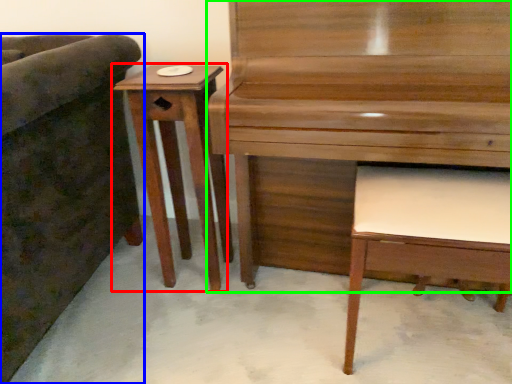
Question: Estimate the real-world distances between objects in this image. Which object is closer to table (highlighted by a red box), furniture (highlighted by a blue box) or piano (highlighted by a green box)?

Choices:
 (A) furniture
 (B) piano

Answer: (A)